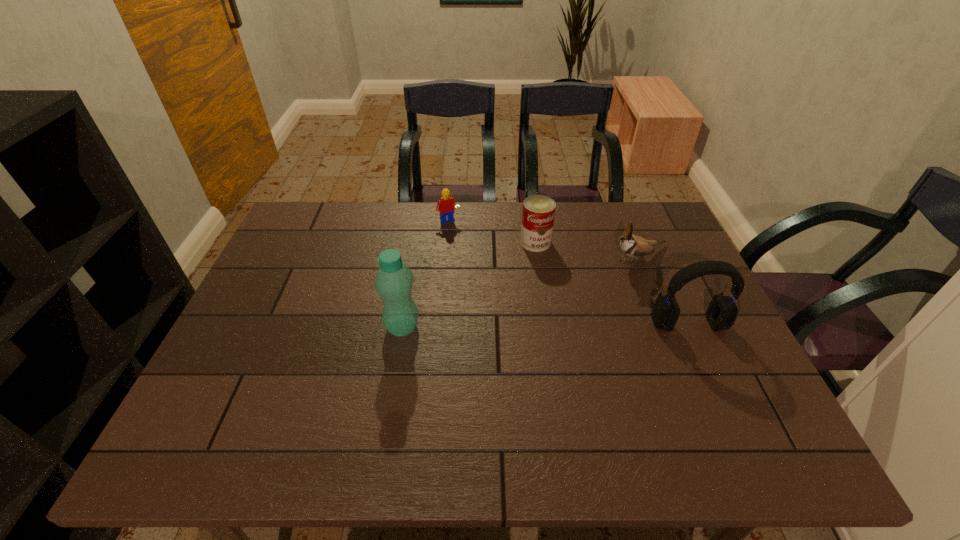
Where is `object that ranks as the closest to the bird`? Image resolution: width=960 pixels, height=540 pixels. object that ranks as the closest to the bird is located at coordinates (722, 311).

This screenshot has width=960, height=540. What are the coordinates of `the third closest object to the Lego` in the screenshot? It's located at (631, 245).

Find the location of `free location that satisfies the following two spatial constraints: 1. on the front side of the shortest object; 2. on the right side of the can`. free location that satisfies the following two spatial constraints: 1. on the front side of the shortest object; 2. on the right side of the can is located at coordinates (446, 242).

Find the location of a particular element. This screenshot has width=960, height=540. vacant space that satisfies the following two spatial constraints: 1. on the front side of the can; 2. on the right side of the bird is located at coordinates (538, 258).